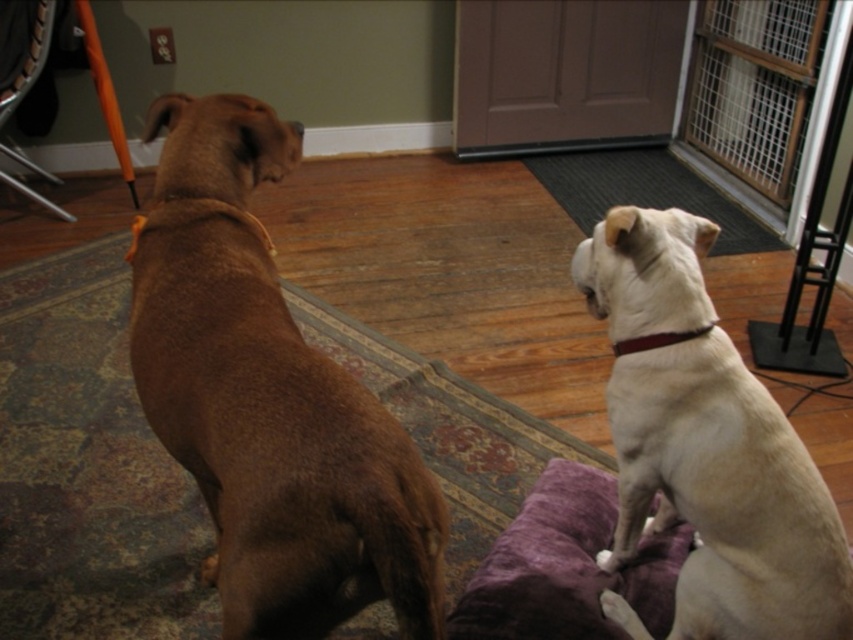
Between brown fur dog at left and purple plush dog bed at center, which one has more height?

Standing taller between the two is brown fur dog at left.

Find the location of `brown fur dog at left`. brown fur dog at left is located at coordinates (268, 397).

Does brown fur dog at left appear under white leather dog at upper right?

Yes, brown fur dog at left is below white leather dog at upper right.

Is point (392, 449) in front of point (654, 528)?

Yes.

Identify the location of brown fur dog at left. The height and width of the screenshot is (640, 853). (268, 397).

Is point (660, 480) positioned before point (605, 577)?

Yes, point (660, 480) is closer to viewer.

Between point (635, 420) and point (689, 548), which one is positioned in front?

Positioned in front is point (635, 420).

Locate an element on the screen. This screenshot has width=853, height=640. white leather dog at upper right is located at coordinates (708, 445).